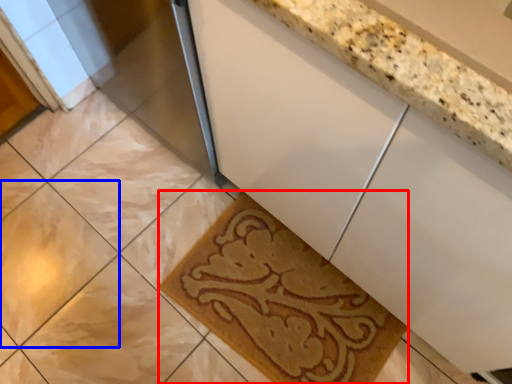
Question: Among these objects, which one is nearest to the camera, bath mat (highlighted by a red box) or ceramic tile (highlighted by a blue box)?

Choices:
 (A) bath mat
 (B) ceramic tile

Answer: (A)